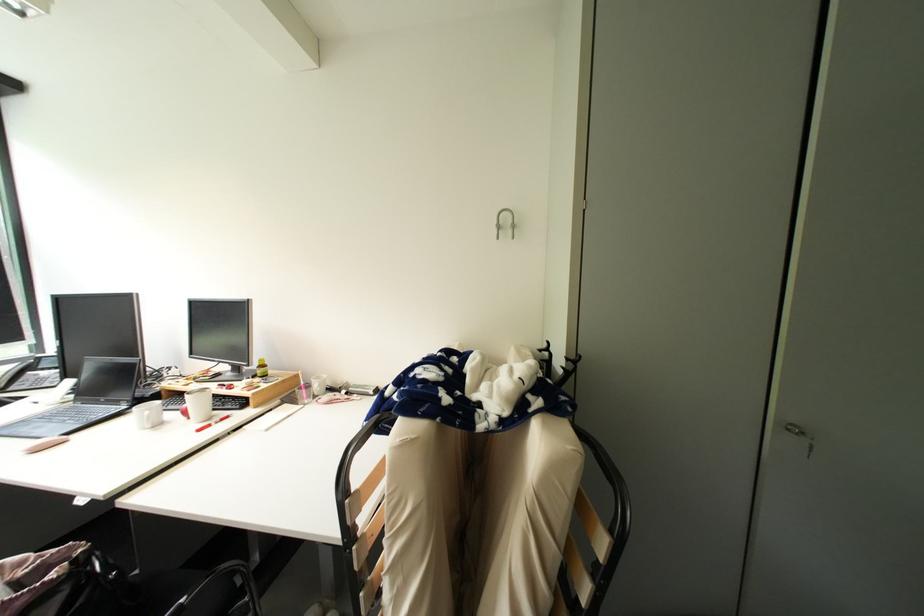
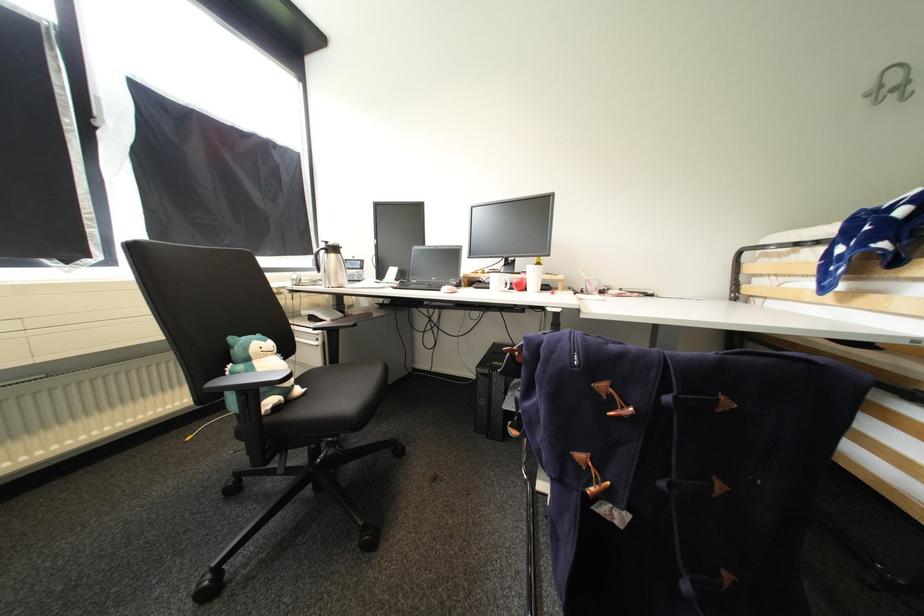
The point at (520, 227) is marked in the first image. Where is the corresponding point in the second image?

(912, 84)